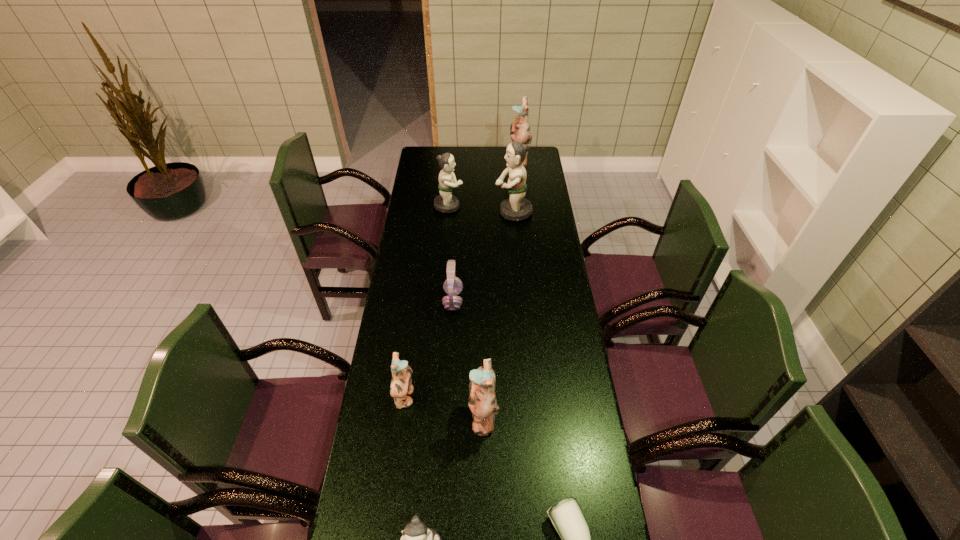
Where is `vacant space situated on the front-facing side of the rightmost green figurine`? The height and width of the screenshot is (540, 960). vacant space situated on the front-facing side of the rightmost green figurine is located at coordinates (457, 212).

Identify the location of vacant space situated on the front-facing side of the farthest pink figurine. (454, 163).

Image resolution: width=960 pixels, height=540 pixels. Find the location of `free space located on the front-facing side of the farthest pink figurine`. free space located on the front-facing side of the farthest pink figurine is located at coordinates (450, 163).

Identify the location of blank space located 0.310m on the front-facing side of the farthest pink figurine. (454, 163).

Identify the location of vacant area situated 0.130m on the front-facing side of the second smallest green figurine. (490, 206).

Identify the location of free space located on the front-facing side of the fourth figurine from left to right. This screenshot has height=540, width=960. (387, 416).

You are a GUI agent. You are given a task and a screenshot of the screen. Output one action in this format:
    pyautogui.click(x=<x>, y=<y>)
    Task: Click on the free location located on the front-facing side of the fourth figurine from left to right
    The width and height of the screenshot is (960, 540).
    Given the screenshot: What is the action you would take?
    pyautogui.click(x=384, y=416)

Where is `vacant space located 0.050m on the front-facing side of the fourth figurine from left to right`? Image resolution: width=960 pixels, height=540 pixels. vacant space located 0.050m on the front-facing side of the fourth figurine from left to right is located at coordinates (454, 416).

You are a GUI agent. You are given a task and a screenshot of the screen. Output one action in this format:
    pyautogui.click(x=<x>, y=<y>)
    Task: Click on the vacant area situated on the front-facing side of the leftmost pink figurine
    Image resolution: width=960 pixels, height=540 pixels.
    Given the screenshot: What is the action you would take?
    pyautogui.click(x=450, y=399)

The width and height of the screenshot is (960, 540). What are the coordinates of `vacant region located on the headband and ear cups of the headset` in the screenshot? It's located at tap(515, 301).